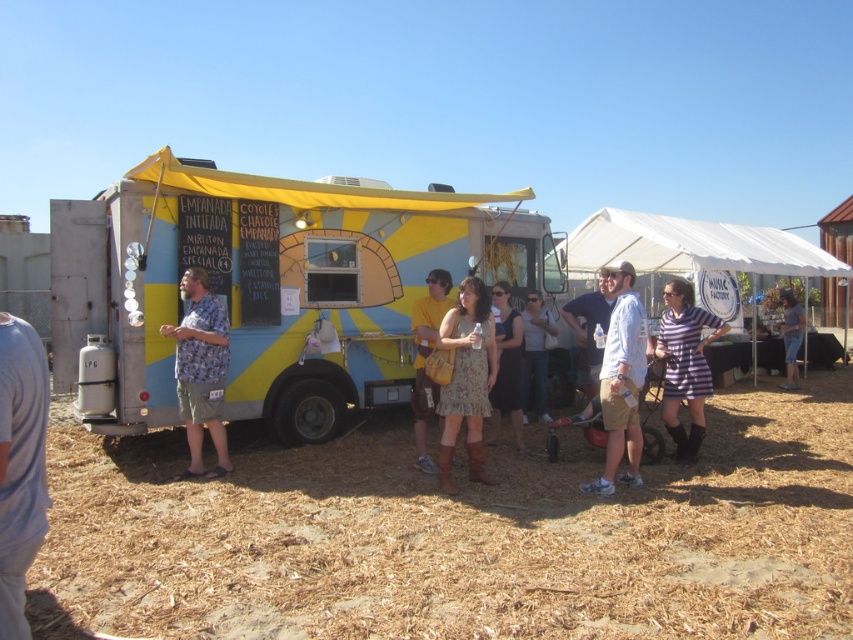
Can you confirm if yellow painted food truck at center is positioned to the left of white fabric canopy at upper right?

Correct, you'll find yellow painted food truck at center to the left of white fabric canopy at upper right.

Is yellow painted food truck at center thinner than white fabric canopy at upper right?

Incorrect, yellow painted food truck at center's width is not less than white fabric canopy at upper right's.

Identify the location of yellow painted food truck at center. (271, 285).

Between white fabric tent at right and floral shirt at center, which one is positioned higher?

Positioned higher is white fabric tent at right.

Who is positioned more to the right, white fabric tent at right or floral shirt at center?

From the viewer's perspective, white fabric tent at right appears more on the right side.

Is point (714, 257) less distant than point (186, 360)?

No.

Find the location of a particular element. white fabric tent at right is located at coordinates (693, 246).

Between floral shirt at center and matte yellow dress at center, which one has more height?

floral shirt at center

Can you confirm if floral shirt at center is bigger than matte yellow dress at center?

Yes.

Is point (206, 362) closer to viewer compared to point (412, 316)?

Yes.

Find the location of `floral shirt at center`. floral shirt at center is located at coordinates (200, 371).